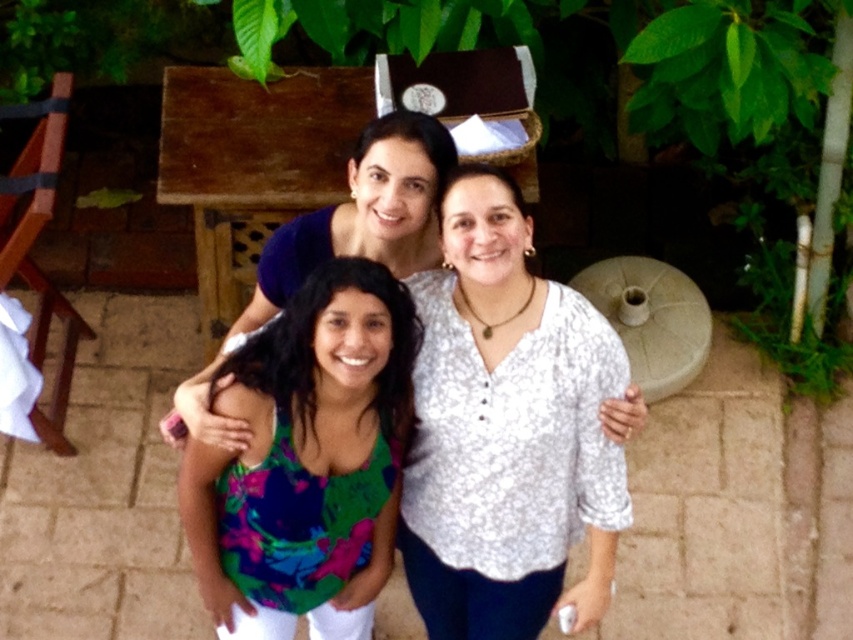
Is point (602, 390) positioned behind point (335, 420)?

That is True.

Between white textured blouse at center and multicolored fabric top at center, which one is positioned higher?

white textured blouse at center

What do you see at coordinates (506, 429) in the screenshot? The width and height of the screenshot is (853, 640). I see `white textured blouse at center` at bounding box center [506, 429].

Identify the location of white textured blouse at center. The width and height of the screenshot is (853, 640). (506, 429).